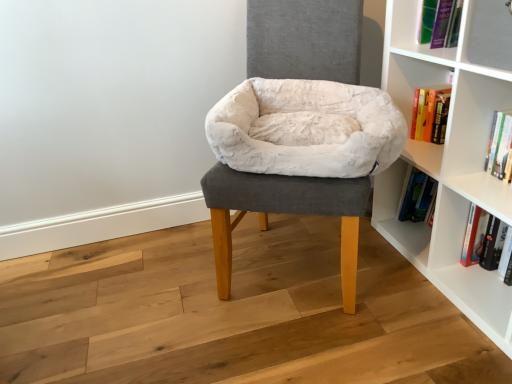
Find the location of a particular element. The width and height of the screenshot is (512, 384). vacant space underneath white plush pet bed at center (from a real-world perspective) is located at coordinates (289, 264).